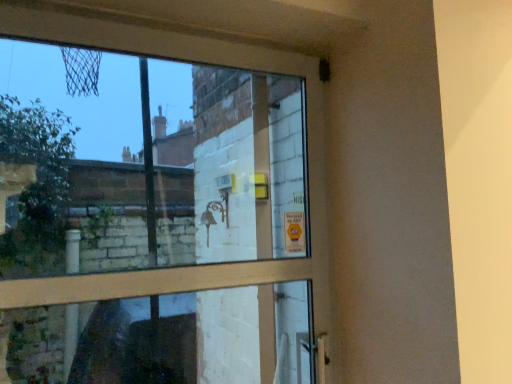
Question: Should I look upward or downward to see transparent glass window at upper center?

Choices:
 (A) up
 (B) down

Answer: (B)